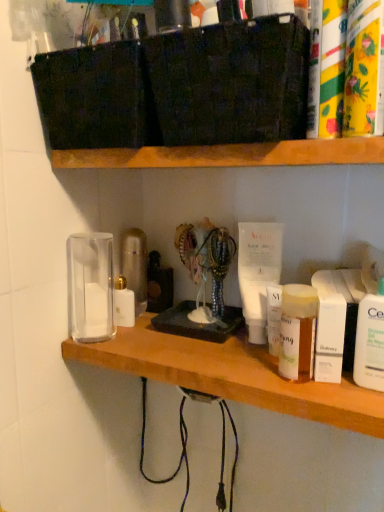
You are a GUI agent. You are given a task and a screenshot of the screen. Output one action in this format:
    pyautogui.click(x=<x>, y=<y>)
    Task: Click on the free space to the left of translucent plastic jar at center right, the 5th toiletry positioned from the front
    The height and width of the screenshot is (512, 384).
    Given the screenshot: What is the action you would take?
    pyautogui.click(x=198, y=362)